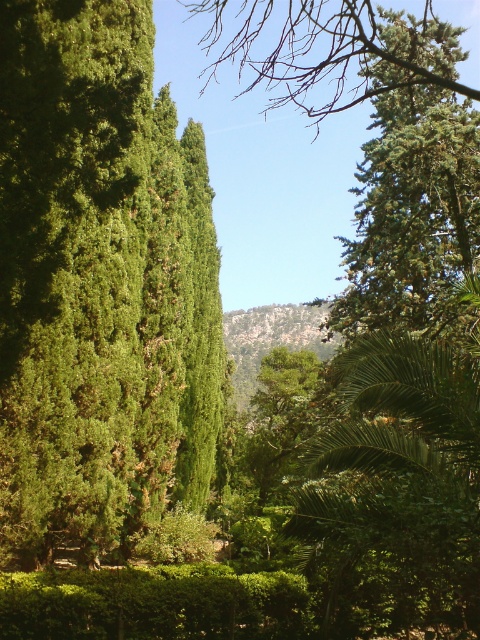
You are standing in the middle of the landscape and want to walk towards the green leafy hedge at center. Which direction should you walk to avoid the green leafy tree at left?

Since the green leafy tree at left is in front of the green leafy hedge at center, you should walk to the right to avoid the green leafy tree at left and head towards the green leafy hedge at center.

You are standing in the lush landscape and want to determine the relative positions of two points marked in the scene. Which point is closer to you, point 1 at coordinates point (67, 330) or point 2 at coordinates point (192, 612)?

Point 1 at coordinates point (67, 330) is closer to you because it is further to the viewer than point 2 at coordinates point (192, 612).

Based on the scene, what are the coordinates of the green leafy tree at left?

The green leafy tree at left is located at coordinates point (99, 282).